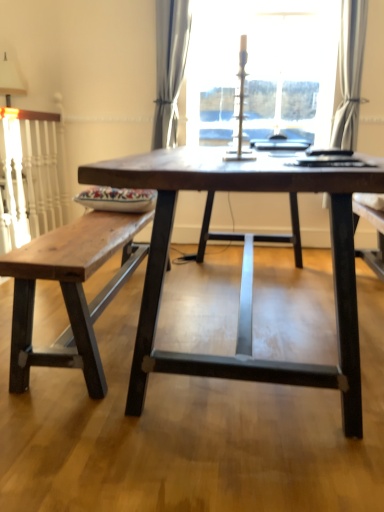
This screenshot has height=512, width=384. What are the coordinates of `rustic wood bench at left` in the screenshot? It's located at (70, 291).

Image resolution: width=384 pixels, height=512 pixels. What do you see at coordinates (70, 291) in the screenshot?
I see `rustic wood bench at left` at bounding box center [70, 291].

I want to click on white sheer curtain at upper right, which appears as the 1th curtain when viewed from the right, so click(x=350, y=73).

The image size is (384, 512). Describe the element at coordinates (169, 67) in the screenshot. I see `satin gray curtain at center, the 2th curtain when ordered from right to left` at that location.

Where is `dark wood table at center`? dark wood table at center is located at coordinates (243, 266).

Locate an element on the screen. The image size is (384, 512). curtain that is the 1st one above the dark wood table at center (from a real-world perspective) is located at coordinates click(169, 67).

Are satin gray curtain at center, the 2th curtain when ordered from right to left, and dark wood table at center beside each other?

No, satin gray curtain at center, the 2th curtain when ordered from right to left, is not making contact with dark wood table at center.

How many degrees apart are the facing directions of satin gray curtain at center, the 2th curtain when ordered from right to left, and dark wood table at center?

The angular difference between satin gray curtain at center, the 2th curtain when ordered from right to left, and dark wood table at center is 92.4 degrees.

Who is more distant, satin gray curtain at center, acting as the 1th curtain starting from the left, or dark wood table at center?

satin gray curtain at center, acting as the 1th curtain starting from the left, is further from the camera.

From a real-world perspective, who is located higher, dark wood table at center or satin gray curtain at center, the 2th curtain when ordered from right to left?

satin gray curtain at center, the 2th curtain when ordered from right to left, from a real-world perspective.

Is dark wood table at center shorter than satin gray curtain at center, acting as the 1th curtain starting from the left?

Yes.

Is dark wood table at center placed right next to satin gray curtain at center, acting as the 1th curtain starting from the left?

There is a gap between dark wood table at center and satin gray curtain at center, acting as the 1th curtain starting from the left.

Does white fabric lampshade at upper left have a greater width compared to white sheer curtain at upper right, which appears as the 1th curtain when viewed from the right?

Indeed, white fabric lampshade at upper left has a greater width compared to white sheer curtain at upper right, which appears as the 1th curtain when viewed from the right.

Is white fabric lampshade at upper left to the right of white sheer curtain at upper right, which is the second curtain from left to right, from the viewer's perspective?

No, white fabric lampshade at upper left is not to the right of white sheer curtain at upper right, which is the second curtain from left to right.

The width and height of the screenshot is (384, 512). I want to click on table lamp to the left of white sheer curtain at upper right, which is the second curtain from left to right, so click(x=10, y=80).

From the picture: Can you see white fabric lampshade at upper left touching white sheer curtain at upper right, which appears as the 1th curtain when viewed from the right?

white fabric lampshade at upper left and white sheer curtain at upper right, which appears as the 1th curtain when viewed from the right, are not in contact.

Is dark wood table at center at the back of transparent glass candlestick at upper center?

No, dark wood table at center is not at the back of transparent glass candlestick at upper center.

Can you see transparent glass candlestick at upper center touching dark wood table at center?

They are not placed beside each other.

Which is less distant, [322,104] or [314,372]?

Point [322,104].

Which of these two, transparent glass candlestick at upper center or dark wood table at center, stands shorter?

dark wood table at center is shorter.

Based on the photo, does white sheer curtain at upper right, which is the second curtain from left to right, turn towards satin gray curtain at center, acting as the 1th curtain starting from the left?

No, white sheer curtain at upper right, which is the second curtain from left to right, is not aimed at satin gray curtain at center, acting as the 1th curtain starting from the left.

Can you tell me how much white sheer curtain at upper right, which appears as the 1th curtain when viewed from the right, and satin gray curtain at center, acting as the 1th curtain starting from the left, differ in facing direction?

5.7e-05 degrees.

Which of these two, white sheer curtain at upper right, which is the second curtain from left to right, or satin gray curtain at center, acting as the 1th curtain starting from the left, is bigger?

With larger size is satin gray curtain at center, acting as the 1th curtain starting from the left.

Which is behind, point (339, 126) or point (166, 58)?

The point (339, 126) is behind.

At what (x,y) coordinates should I click in order to perform the action: click on curtain that is the 2nd object located behind the rustic wood bench at left. Please return your answer as a coordinate pair (x, y). Image resolution: width=384 pixels, height=512 pixels. Looking at the image, I should click on (169, 67).

From a real-world perspective, is satin gray curtain at center, the 2th curtain when ordered from right to left, positioned above or below rustic wood bench at left?

satin gray curtain at center, the 2th curtain when ordered from right to left, is above rustic wood bench at left.

Which is closer, (163, 134) or (85, 304)?

The point (85, 304) is in front.

From the image's perspective, is rustic wood bench at left located above transparent glass candlestick at upper center?

No, from the image's perspective, rustic wood bench at left is not over transparent glass candlestick at upper center.

From a real-world perspective, between rustic wood bench at left and transparent glass candlestick at upper center, who is vertically lower?

From a 3D spatial view, rustic wood bench at left is below.

Is rustic wood bench at left at the right side of transparent glass candlestick at upper center?

No, rustic wood bench at left is not to the right of transparent glass candlestick at upper center.

The height and width of the screenshot is (512, 384). I want to click on the 2nd curtain positioned above the dark wood table at center (from the image's perspective), so click(x=169, y=67).

Locate an element on the screen. curtain to the left of dark wood table at center is located at coordinates (169, 67).

Estimate the real-world distances between objects in this image. Which object is further from satin gray curtain at center, the 2th curtain when ordered from right to left, white sheer curtain at upper right, which is the second curtain from left to right, or transparent glass candlestick at upper center?

white sheer curtain at upper right, which is the second curtain from left to right, is further to satin gray curtain at center, the 2th curtain when ordered from right to left.

From the image, which object appears to be nearer to transparent glass candlestick at upper center, white sheer curtain at upper right, which is the second curtain from left to right, or satin gray curtain at center, the 2th curtain when ordered from right to left?

white sheer curtain at upper right, which is the second curtain from left to right, is positioned closer to the anchor transparent glass candlestick at upper center.

From the image, which object appears to be farther from transparent glass candlestick at upper center, white fabric lampshade at upper left or dark wood table at center?

dark wood table at center is positioned further to the anchor transparent glass candlestick at upper center.

Estimate the real-world distances between objects in this image. Which object is further from white sheer curtain at upper right, which is the second curtain from left to right, dark wood table at center or transparent glass candlestick at upper center?

dark wood table at center is further to white sheer curtain at upper right, which is the second curtain from left to right.

Considering their positions, is dark wood table at center positioned further to satin gray curtain at center, the 2th curtain when ordered from right to left, than white fabric lampshade at upper left?

Based on the image, dark wood table at center appears to be further to satin gray curtain at center, the 2th curtain when ordered from right to left.

Estimate the real-world distances between objects in this image. Which object is closer to transparent glass candlestick at upper center, dark wood table at center or satin gray curtain at center, the 2th curtain when ordered from right to left?

satin gray curtain at center, the 2th curtain when ordered from right to left, is positioned closer to the anchor transparent glass candlestick at upper center.

Which object lies further to the anchor point rustic wood bench at left, dark wood table at center or transparent glass candlestick at upper center?

The object further to rustic wood bench at left is transparent glass candlestick at upper center.

When comparing their distances from satin gray curtain at center, acting as the 1th curtain starting from the left, does white fabric lampshade at upper left or white sheer curtain at upper right, which is the second curtain from left to right, seem closer?

white fabric lampshade at upper left lies closer to satin gray curtain at center, acting as the 1th curtain starting from the left, than the other object.

At what (x,y) coordinates should I click in order to perform the action: click on table lamp between dark wood table at center and transparent glass candlestick at upper center along the z-axis. Please return your answer as a coordinate pair (x, y). Image resolution: width=384 pixels, height=512 pixels. Looking at the image, I should click on coord(10,80).

You are a GUI agent. You are given a task and a screenshot of the screen. Output one action in this format:
    pyautogui.click(x=<x>, y=<y>)
    Task: Click on the table located between dark wood table at center and satin gray curtain at center, the 2th curtain when ordered from right to left, in the depth direction
    Image resolution: width=384 pixels, height=512 pixels.
    Given the screenshot: What is the action you would take?
    pyautogui.click(x=70, y=291)

You are a GUI agent. You are given a task and a screenshot of the screen. Output one action in this format:
    pyautogui.click(x=<x>, y=<y>)
    Task: Click on the table lamp between rustic wood bench at left and transparent glass candlestick at upper center along the z-axis
    
    Given the screenshot: What is the action you would take?
    pyautogui.click(x=10, y=80)

Identify the location of curtain between rustic wood bench at left and satin gray curtain at center, acting as the 1th curtain starting from the left, from front to back. Image resolution: width=384 pixels, height=512 pixels. (350, 73).